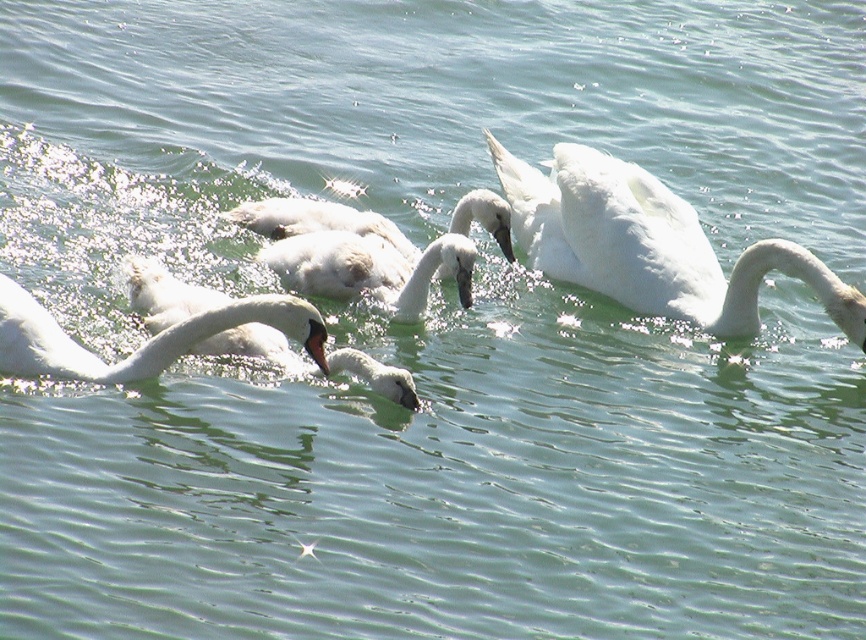
Which is behind, point (664, 298) or point (320, 346)?

Point (664, 298)

Between white glossy swan at upper right and white glossy swan at left, which one appears on the left side from the viewer's perspective?

Positioned to the left is white glossy swan at left.

What do you see at coordinates (650, 244) in the screenshot? Image resolution: width=866 pixels, height=640 pixels. I see `white glossy swan at upper right` at bounding box center [650, 244].

Find the location of a particular element. Image resolution: width=866 pixels, height=640 pixels. white glossy swan at upper right is located at coordinates (650, 244).

Which is above, white glossy swan at upper right or white matte duck at center?

Positioned higher is white glossy swan at upper right.

At what (x,y) coordinates should I click in order to perform the action: click on white glossy swan at upper right. Please return your answer as a coordinate pair (x, y). Looking at the image, I should click on (650, 244).

Image resolution: width=866 pixels, height=640 pixels. Identify the location of white glossy swan at upper right. (650, 244).

Is point (278, 300) less distant than point (307, 209)?

Yes.

Is white glossy swan at left shorter than white feathered swan at center?

In fact, white glossy swan at left may be taller than white feathered swan at center.

Does point (318, 324) lie behind point (299, 208)?

No, it is not.

This screenshot has width=866, height=640. I want to click on white glossy swan at left, so click(x=141, y=344).